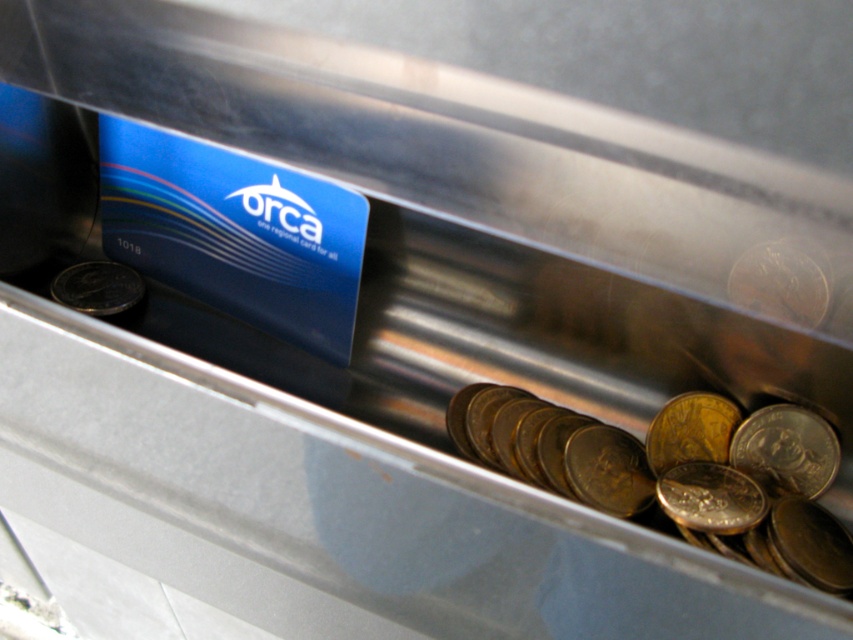
Question: Which object appears closest to the camera in this image?

Choices:
 (A) gold metallic coin at left
 (B) silver metallic coin at lower right

Answer: (B)

Question: Is gold metallic coins at center below gold metallic coin at left?

Choices:
 (A) no
 (B) yes

Answer: (B)

Question: Which point appears farthest from the camera in this image?

Choices:
 (A) (737, 273)
 (B) (660, 502)

Answer: (B)

Question: Among these points, which one is nearest to the camera?

Choices:
 (A) (766, 435)
 (B) (674, 440)
 (C) (732, 472)
 (D) (784, 257)

Answer: (D)

Question: Can you confirm if gold metallic coin at center is smaller than gold metallic coin at right?

Choices:
 (A) yes
 (B) no

Answer: (B)

Question: From the image, what is the correct spatial relationship of gold metallic coin at right in relation to gold metallic coin at left?

Choices:
 (A) below
 (B) above

Answer: (A)